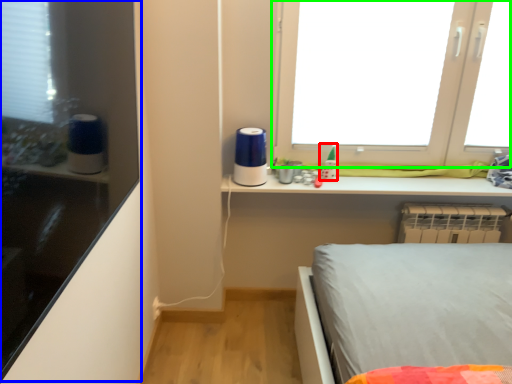
Question: Estimate the real-world distances between objects in this image. Which object is closer to toy (highlighted by a red box), shelf (highlighted by a blue box) or window (highlighted by a green box)?

Choices:
 (A) shelf
 (B) window

Answer: (B)